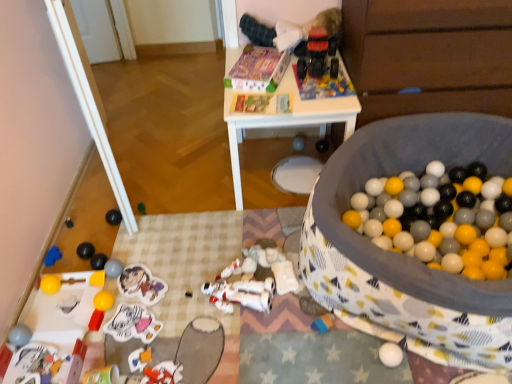
Find the location of a particular element. vacant space that is in between white fabric doll at center, placed as the fifth toy when sorted from right to left, and matte gray ball at lower left, which is counted as the tenth toy, starting from the left is located at coordinates (197, 279).